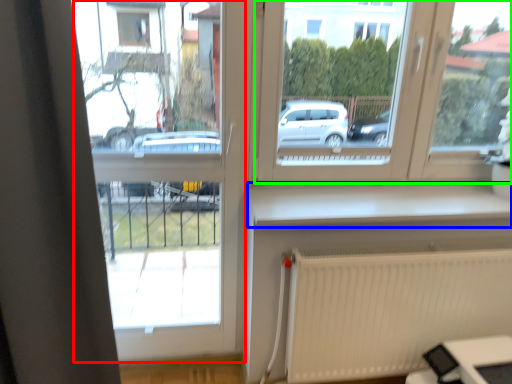
Question: Which is farther away from window frame (highlighted by a red box)? window sill (highlighted by a blue box) or window (highlighted by a green box)?

Choices:
 (A) window sill
 (B) window

Answer: (A)